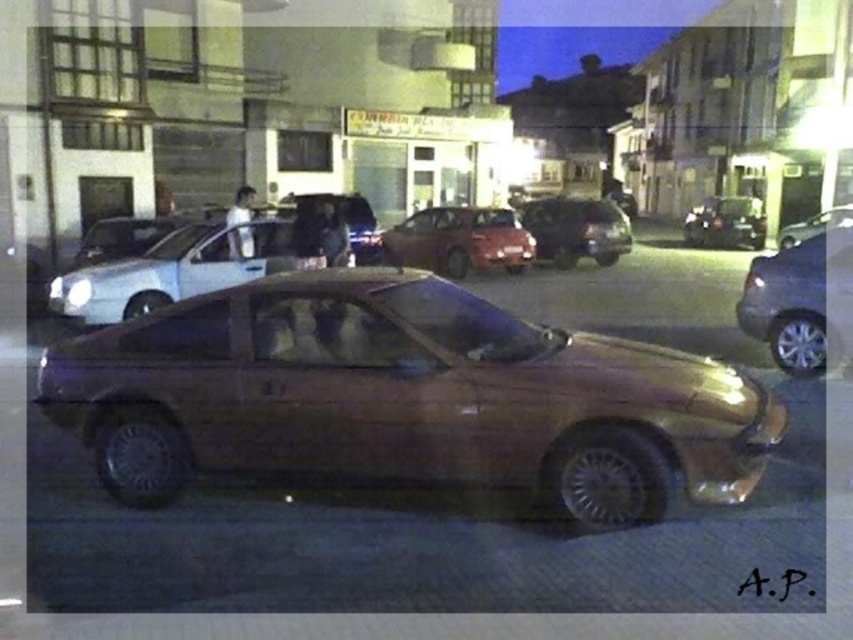
Can you confirm if gold metallic car at center is positioned above satin silver car at center?

Incorrect, gold metallic car at center is not positioned above satin silver car at center.

Is gold metallic car at center positioned at the back of satin silver car at center?

No, it is in front of satin silver car at center.

The width and height of the screenshot is (853, 640). I want to click on gold metallic car at center, so click(x=405, y=397).

Which of these two, satin silver car at center or black plastic license plate at center, stands taller?

satin silver car at center

Which is more to the left, satin silver car at center or black plastic license plate at center?

satin silver car at center

Locate an element on the screen. The height and width of the screenshot is (640, 853). satin silver car at center is located at coordinates (177, 269).

Where is `satin silver car at center`? satin silver car at center is located at coordinates (177, 269).

Is point (467, 307) farther from camera compared to point (807, 236)?

No, (467, 307) is closer to viewer.

Is gold metallic car at center below shiny silver car at right?

Yes.

Is point (224, 371) closer to camera compared to point (809, 227)?

Yes.

The width and height of the screenshot is (853, 640). I want to click on gold metallic car at center, so click(x=405, y=397).